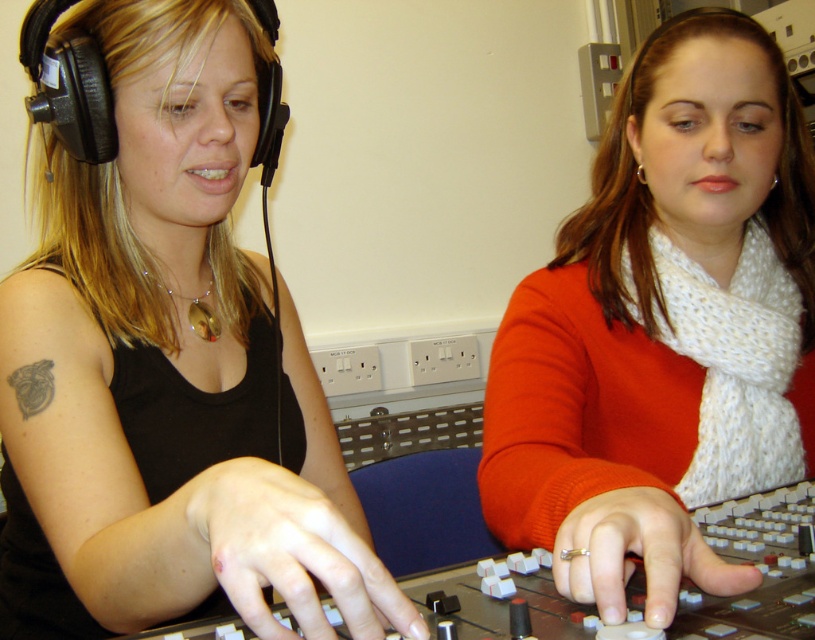
You are a technician who needs to adjust the headphones of the person at the left without moving your position. The white knitted scarf at center is in your line of sight. Can you reach the matte black headphones at left without moving the scarf?

The distance between the matte black headphones at left and the white knitted scarf at center is 14.19 inches. Since the scarf is in your line of sight but not blocking the path, you can reach the matte black headphones at left as long as the 14.19 inches distance allows for comfortable adjustment without disturbing the scarf.

You are a sound technician in a radio station. You need to determine which object is larger between the matte black headphones at left and the white knitted scarf at center. Based on the scene description, which one is bigger?

The matte black headphones at left is bigger than white knitted scarf at center according to the description.